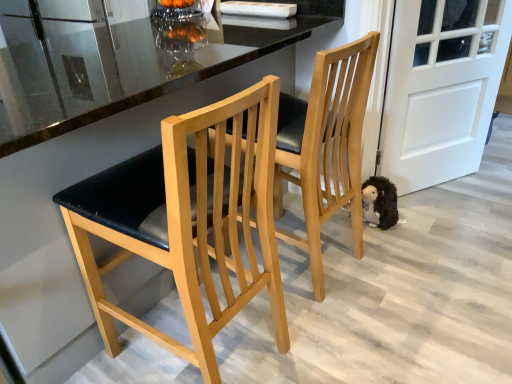
Question: Is matte wood chair at center, which is counted as the 1th chair, starting from the right, shorter than matte black seat at center, acting as the second chair starting from the right?

Choices:
 (A) no
 (B) yes

Answer: (B)

Question: Does matte wood chair at center, placed as the second chair when sorted from left to right, appear on the left side of matte black seat at center, acting as the first chair starting from the left?

Choices:
 (A) yes
 (B) no

Answer: (B)

Question: From the image's perspective, is matte wood chair at center, which is counted as the 1th chair, starting from the right, above matte black seat at center, acting as the first chair starting from the left?

Choices:
 (A) yes
 (B) no

Answer: (A)

Question: Is matte wood chair at center, which is counted as the 1th chair, starting from the right, taller than matte black seat at center, acting as the first chair starting from the left?

Choices:
 (A) yes
 (B) no

Answer: (B)

Question: From a real-world perspective, is matte wood chair at center, which is counted as the 1th chair, starting from the right, below matte black seat at center, acting as the second chair starting from the right?

Choices:
 (A) yes
 (B) no

Answer: (B)

Question: Considering the relative sizes of matte wood chair at center, which is counted as the 1th chair, starting from the right, and matte black seat at center, acting as the second chair starting from the right, in the image provided, is matte wood chair at center, which is counted as the 1th chair, starting from the right, smaller than matte black seat at center, acting as the second chair starting from the right,?

Choices:
 (A) yes
 (B) no

Answer: (B)

Question: Does matte wood chair at center, which is counted as the 1th chair, starting from the right, have a lesser width compared to white matte door at right?

Choices:
 (A) yes
 (B) no

Answer: (B)

Question: Can you confirm if matte wood chair at center, which is counted as the 1th chair, starting from the right, is wider than white matte door at right?

Choices:
 (A) yes
 (B) no

Answer: (A)

Question: Does matte wood chair at center, which is counted as the 1th chair, starting from the right, have a smaller size compared to white matte door at right?

Choices:
 (A) yes
 (B) no

Answer: (B)

Question: Considering the relative sizes of matte wood chair at center, placed as the second chair when sorted from left to right, and white matte door at right in the image provided, is matte wood chair at center, placed as the second chair when sorted from left to right, shorter than white matte door at right?

Choices:
 (A) no
 (B) yes

Answer: (B)

Question: Can you confirm if matte wood chair at center, which is counted as the 1th chair, starting from the right, is positioned to the right of white matte door at right?

Choices:
 (A) no
 (B) yes

Answer: (A)

Question: From the image's perspective, is matte wood chair at center, which is counted as the 1th chair, starting from the right, under white matte door at right?

Choices:
 (A) yes
 (B) no

Answer: (A)

Question: From the image's perspective, is fuzzy brown plush at lower right located beneath white matte door at right?

Choices:
 (A) yes
 (B) no

Answer: (A)